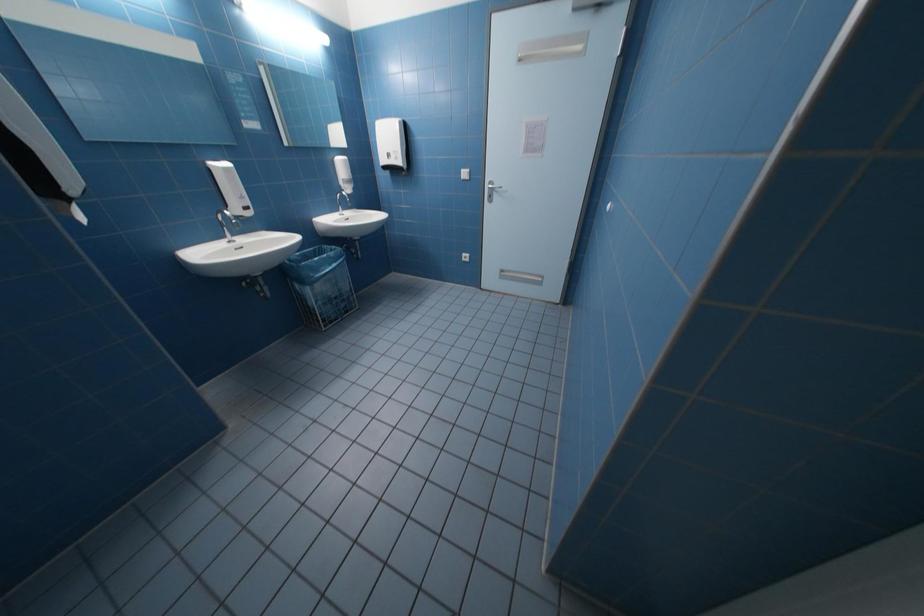
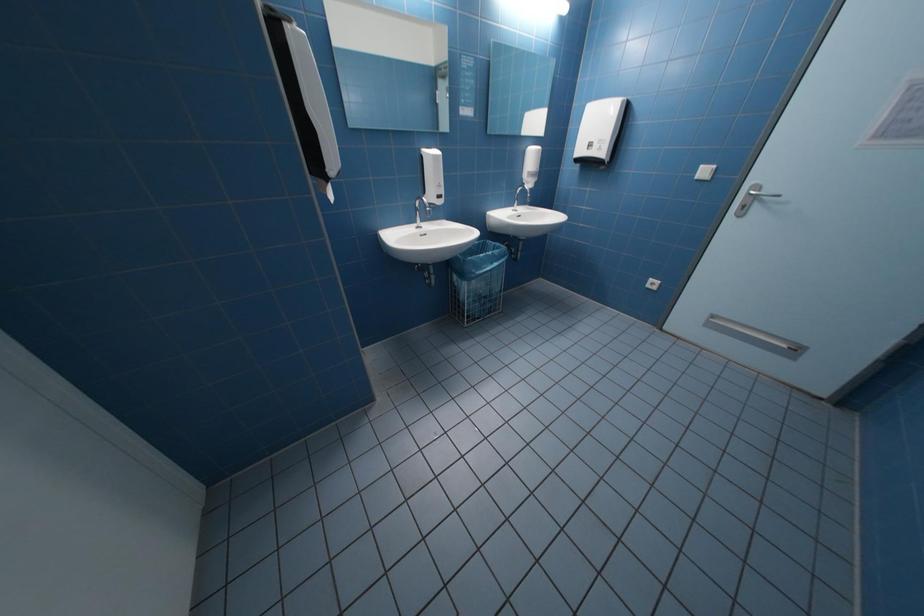
Question: Based on the continuous images, in which direction is the camera rotating? Reply with the corresponding letter.

Choices:
 (A) Left
 (B) Right
 (C) Up
 (D) Down

Answer: (A)